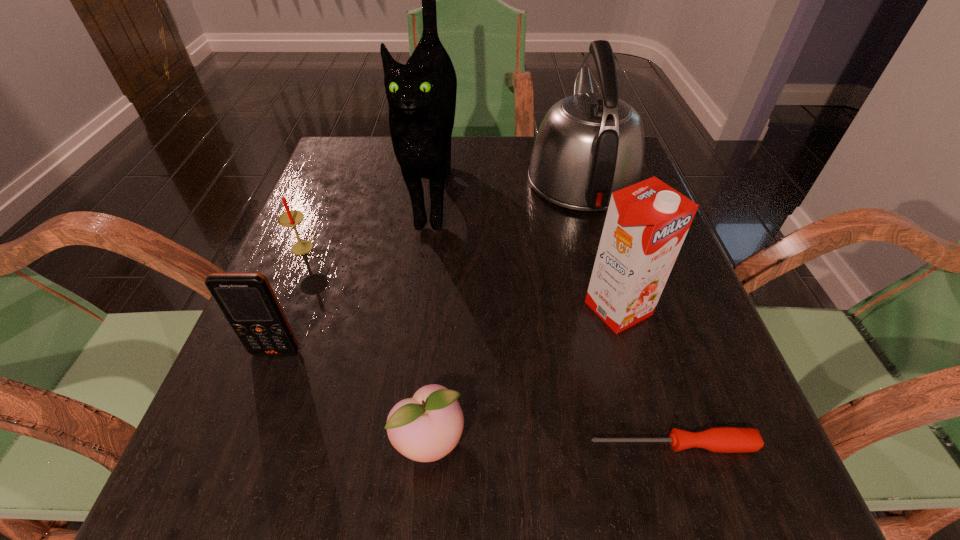
At what (x,y) coordinates should I click in order to perform the action: click on free area in between the peach and the fourth tallest object. Please return your answer as a coordinate pair (x, y). This screenshot has height=540, width=960. Looking at the image, I should click on (352, 396).

Locate an element on the screen. vacant space that's between the shortest object and the peach is located at coordinates (551, 442).

Where is `vacant area between the screwdriver and the candle`? This screenshot has height=540, width=960. vacant area between the screwdriver and the candle is located at coordinates (489, 346).

Identify the location of empty space that is in between the fourth farthest object and the screwdriver. Image resolution: width=960 pixels, height=540 pixels. (645, 376).

At what (x,y) coordinates should I click in order to perform the action: click on object that ranks as the second closest to the candle. Please return your answer as a coordinate pair (x, y). This screenshot has height=540, width=960. Looking at the image, I should click on (247, 300).

Select which object is the sixth closest to the carton. Please provide its 2D coordinates. Your answer should be formatted as a tuple, i.e. [(x, y)], where the tuple contains the x and y coordinates of a point satisfying the conditions above.

[(292, 218)]